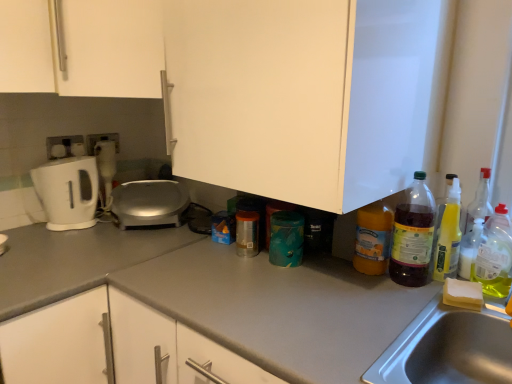
At what (x,y) coordinates should I click in order to perform the action: click on unoccupied area in front of translucent plastic bottle at right, placed as the second bottle when sorted from left to right. Please return your answer as a coordinate pair (x, y). Looking at the image, I should click on (403, 302).